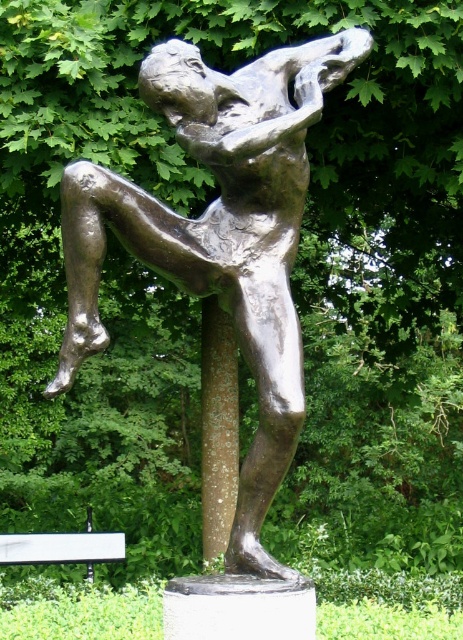
Question: Can you confirm if bronze statue at center is smaller than white plastic bench at lower left?

Choices:
 (A) no
 (B) yes

Answer: (A)

Question: Does bronze statue at center have a lesser width compared to white plastic bench at lower left?

Choices:
 (A) no
 (B) yes

Answer: (A)

Question: Is bronze statue at center positioned before white plastic bench at lower left?

Choices:
 (A) yes
 (B) no

Answer: (A)

Question: Which point is farther to the camera?

Choices:
 (A) bronze statue at center
 (B) white plastic bench at lower left

Answer: (B)

Question: Which object appears closest to the camera in this image?

Choices:
 (A) bronze statue at center
 (B) white plastic bench at lower left

Answer: (A)

Question: Which point is closer to the camera?

Choices:
 (A) white plastic bench at lower left
 (B) bronze statue at center

Answer: (B)